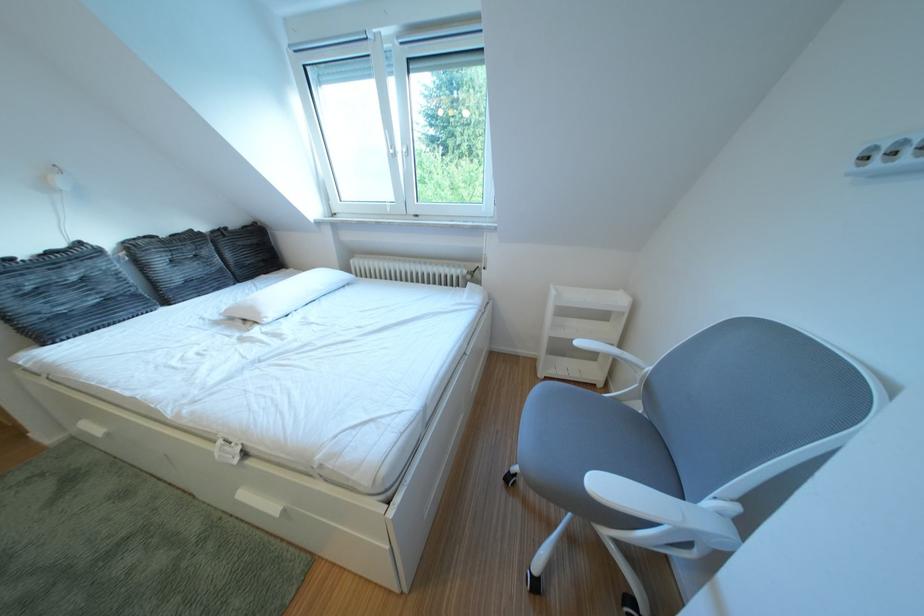
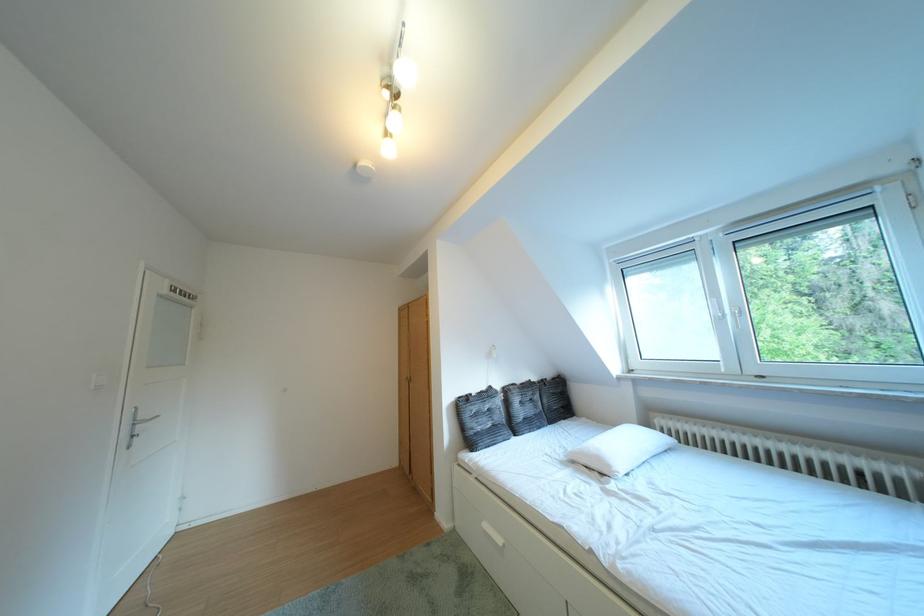
Locate, in the second image, the point that corresponds to the point at 273,318 in the first image.

(623, 471)